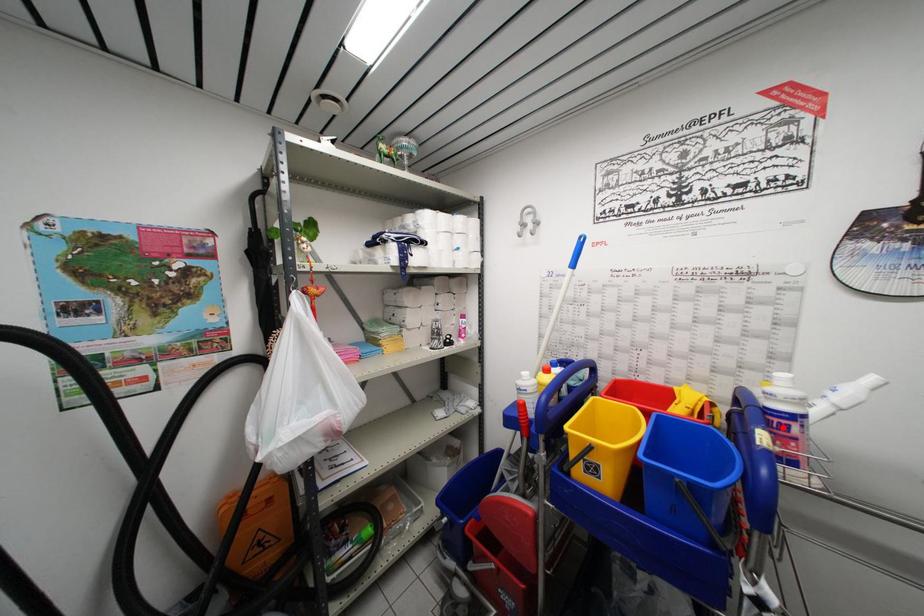
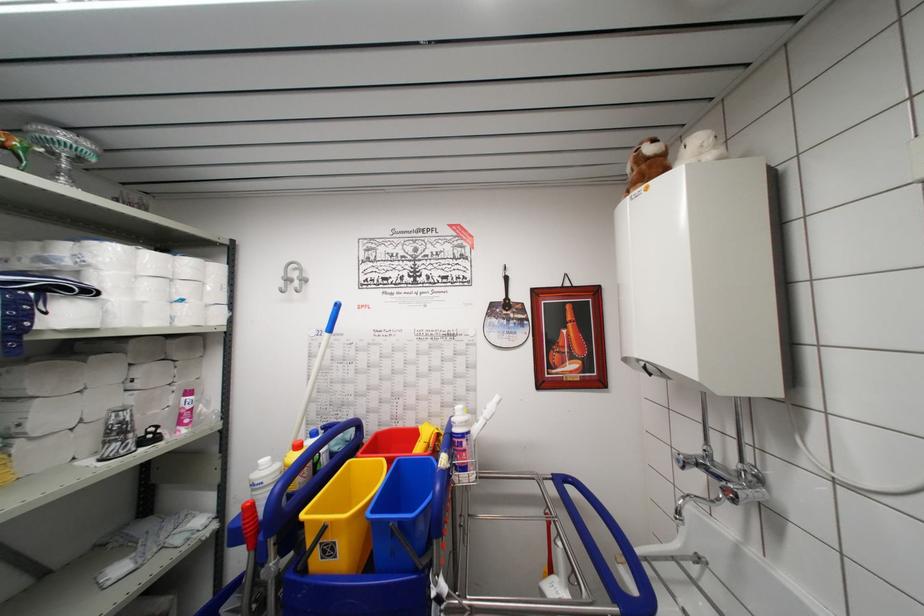
Locate, in the second image, the point that corresponds to the highlighted location in the first image.

(460, 447)